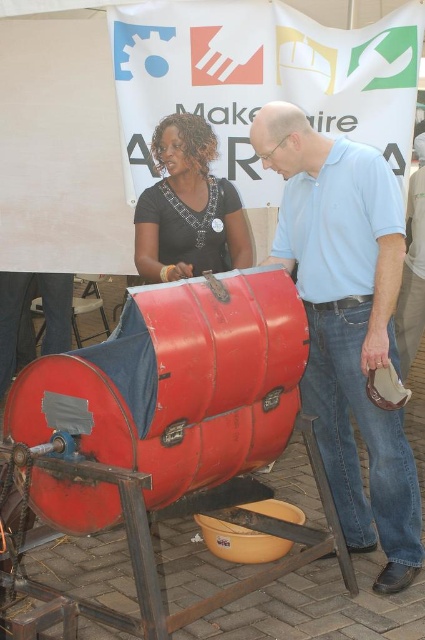
Question: Which point is closer to the camera?

Choices:
 (A) (376, 192)
 (B) (238, 205)

Answer: (A)

Question: Is light blue shirt at center bigger than matte black shirt at upper left?

Choices:
 (A) no
 (B) yes

Answer: (B)

Question: Which of the following is the farthest from the observer?

Choices:
 (A) (294, 186)
 (B) (141, 205)

Answer: (B)

Question: Is light blue shirt at center above matte black shirt at upper left?

Choices:
 (A) no
 (B) yes

Answer: (A)

Question: From the image, what is the correct spatial relationship of light blue shirt at center in relation to matte black shirt at upper left?

Choices:
 (A) above
 (B) below

Answer: (B)

Question: Which point appears closest to the camera in this image?

Choices:
 (A) (300, 260)
 (B) (215, 243)

Answer: (A)